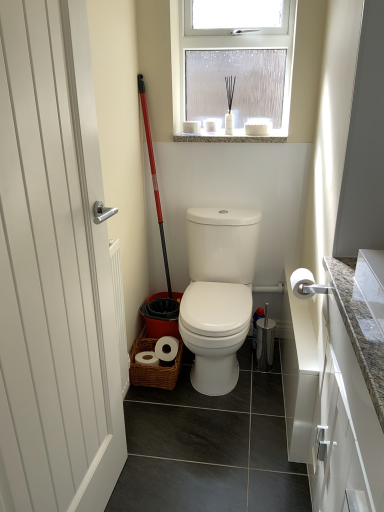
Image resolution: width=384 pixels, height=512 pixels. Identify the location of free space in front of white glossy toilet at center. (219, 403).